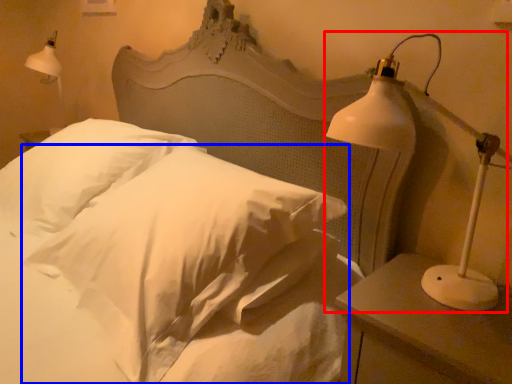
Question: Which of the following is the closest to the observer, lamp (highlighted by a red box) or pillow (highlighted by a blue box)?

Choices:
 (A) lamp
 (B) pillow

Answer: (A)